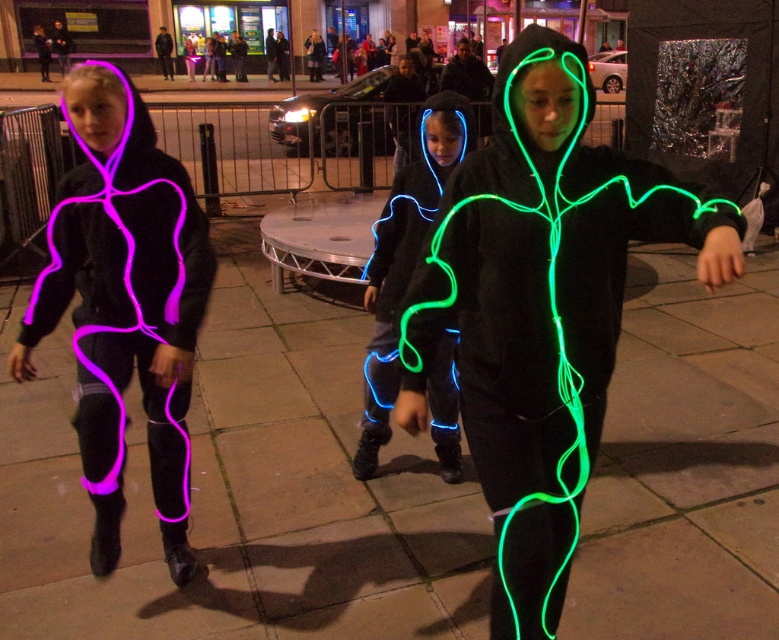
Question: Is slate stone pavement at center thinner than matte black hoodie at left?

Choices:
 (A) yes
 (B) no

Answer: (B)

Question: Is slate stone pavement at center thinner than matte black hoodie at left?

Choices:
 (A) no
 (B) yes

Answer: (A)

Question: Which of the following is the closest to the observer?

Choices:
 (A) neon blue fabric at center
 (B) slate stone pavement at center
 (C) green neon lines at center

Answer: (C)

Question: Which is farther from the slate stone pavement at center?

Choices:
 (A) green neon lines at center
 (B) matte black hoodie at left

Answer: (A)

Question: Which object appears farthest from the camera in this image?

Choices:
 (A) green neon lines at center
 (B) neon blue fabric at center
 (C) slate stone pavement at center

Answer: (B)

Question: Does slate stone pavement at center have a larger size compared to matte black hoodie at left?

Choices:
 (A) yes
 (B) no

Answer: (A)